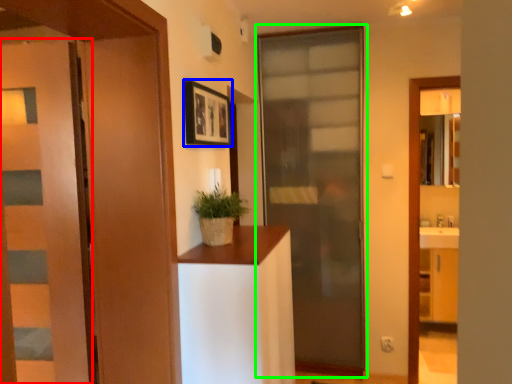
Question: Which object is the closest to the door (highlighted by a red box)? Choose among these: picture frame (highlighted by a blue box) or door (highlighted by a green box).

Choices:
 (A) picture frame
 (B) door

Answer: (A)